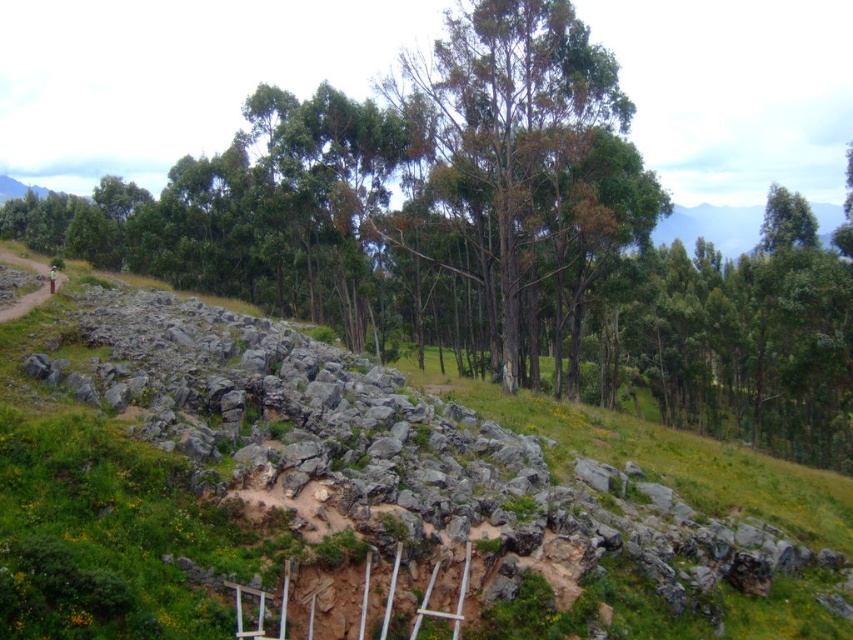
Question: Which point is farther to the camera?

Choices:
 (A) (503, 17)
 (B) (646, 484)
 (C) (621, 122)

Answer: (C)

Question: Which of these objects is positioned closest to the gray rock wall at center?

Choices:
 (A) green leafy trees at center
 (B) green leafy tree at center

Answer: (A)

Question: Does gray rock wall at center appear over green leafy tree at center?

Choices:
 (A) no
 (B) yes

Answer: (A)

Question: Does gray rock wall at center appear on the right side of green leafy tree at center?

Choices:
 (A) no
 (B) yes

Answer: (B)

Question: Can you confirm if gray rock wall at center is thinner than green leafy tree at center?

Choices:
 (A) no
 (B) yes

Answer: (B)

Question: Which of the following is the farthest from the observer?

Choices:
 (A) gray rock wall at center
 (B) green leafy trees at center
 (C) green leafy tree at center

Answer: (C)